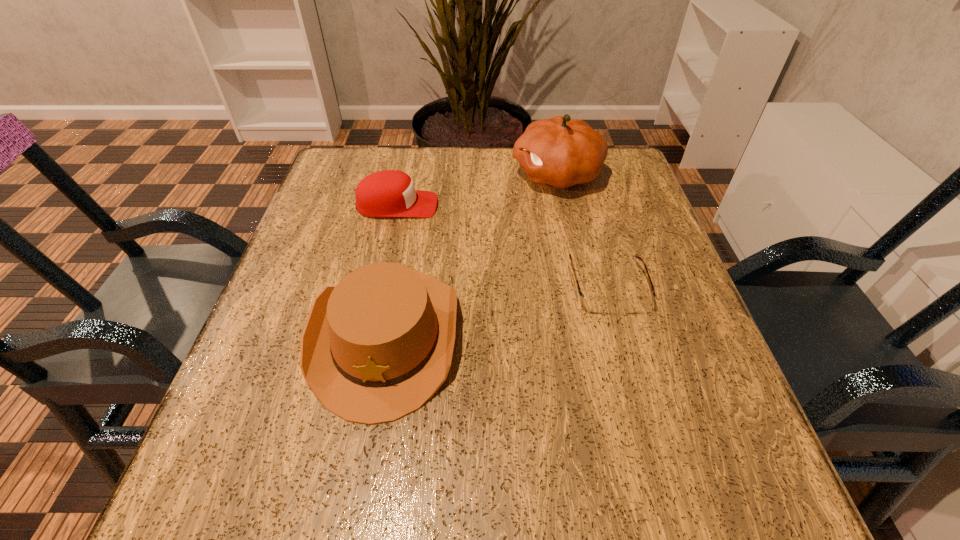
In order to click on pumpkin present at the far edge in this screenshot , I will do `click(560, 151)`.

You are a GUI agent. You are given a task and a screenshot of the screen. Output one action in this format:
    pyautogui.click(x=<x>, y=<y>)
    Task: Click on the baseball cap located in the far edge section of the desktop
    This screenshot has width=960, height=540.
    Given the screenshot: What is the action you would take?
    pyautogui.click(x=389, y=193)

This screenshot has width=960, height=540. Find the location of `cowboy hat located in the left edge section of the desktop`. cowboy hat located in the left edge section of the desktop is located at coordinates (376, 347).

This screenshot has width=960, height=540. What are the coordinates of `baseball cap present at the left edge` in the screenshot? It's located at (389, 193).

Identify the location of pumpkin located in the right edge section of the desktop. (560, 151).

The height and width of the screenshot is (540, 960). Find the location of `spectacles that is at the right edge`. spectacles that is at the right edge is located at coordinates (592, 304).

Identify the location of object located in the far left corner section of the desktop. (389, 193).

Locate an element on the screen. object that is at the far right corner is located at coordinates (560, 151).

Where is `free spot at the far edge of the desktop`? The image size is (960, 540). free spot at the far edge of the desktop is located at coordinates (515, 183).

In the image, there is a desktop. At what (x,y) coordinates should I click in order to perform the action: click on vacant space at the left edge. Please return your answer as a coordinate pair (x, y). The image size is (960, 540). Looking at the image, I should click on (255, 442).